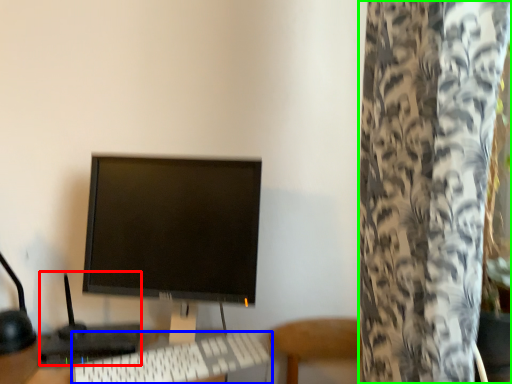
Question: Considering the real-world distances, which object is farthest from computer (highlighted by a red box)? computer keyboard (highlighted by a blue box) or curtain (highlighted by a green box)?

Choices:
 (A) computer keyboard
 (B) curtain

Answer: (B)